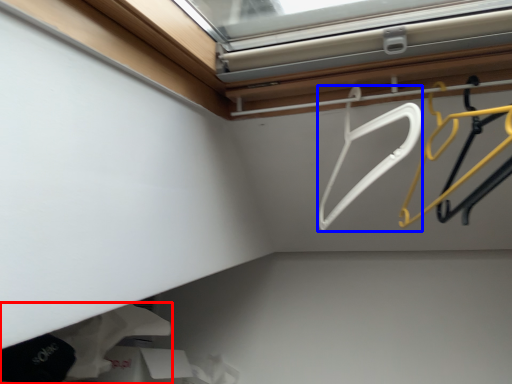
Question: Which point is closer to the camera, clothing (highlighted by a red box) or hanger (highlighted by a blue box)?

Choices:
 (A) clothing
 (B) hanger

Answer: (B)